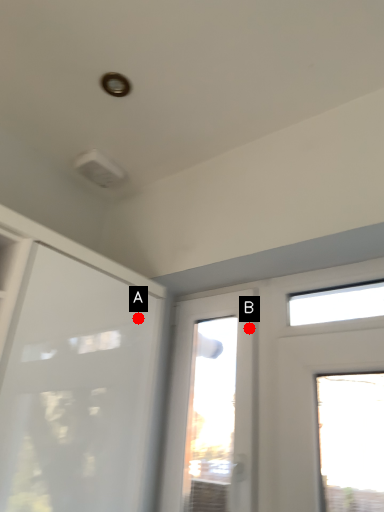
Question: Two points are circled on the image, labeled by A and B beside each circle. Which point appears closest to the camera in this image?

Choices:
 (A) A is closer
 (B) B is closer

Answer: (A)